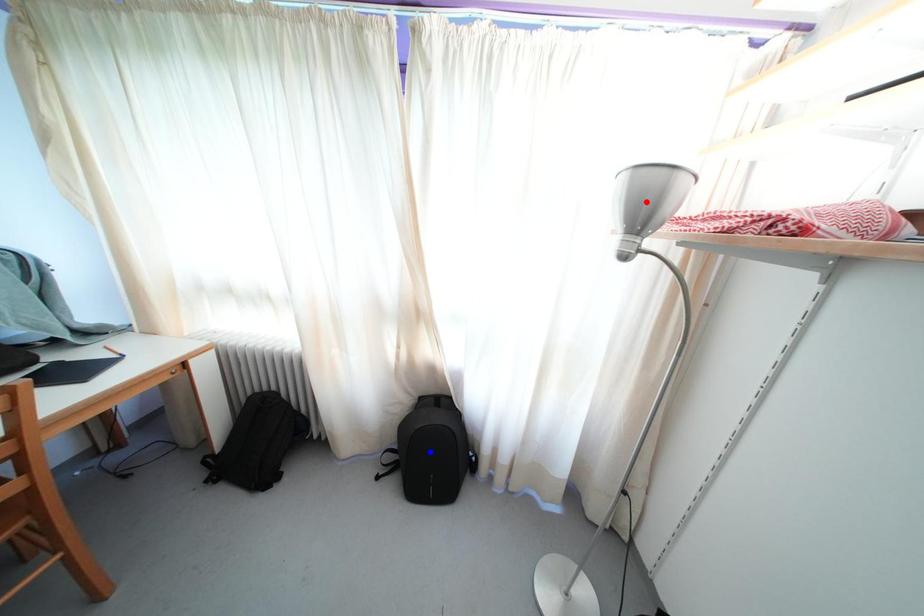
Question: Two points are marked on the image. Which point is closer to the camera?

Choices:
 (A) Blue point is closer.
 (B) Red point is closer.

Answer: (B)